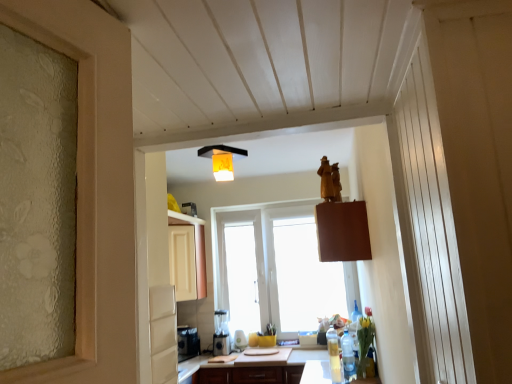
Describe the element at coordinates (221, 334) in the screenshot. I see `black plastic coffee machine at lower center` at that location.

Where is `black plastic coffee machine at lower center`? This screenshot has height=384, width=512. black plastic coffee machine at lower center is located at coordinates (221, 334).

Looking at this image, what is the approximate height of clear plastic bottle at lower right, acting as the 1th bottle starting from the front?

The height of clear plastic bottle at lower right, acting as the 1th bottle starting from the front, is 13.37 inches.

This screenshot has height=384, width=512. What are the coordinates of `clear plastic bottle at lower right, which ranks as the second bottle in back-to-front order` in the screenshot? It's located at (348, 355).

This screenshot has height=384, width=512. Describe the element at coordinates (334, 354) in the screenshot. I see `translucent plastic bottle at lower right, arranged as the second bottle when viewed from the front` at that location.

You are a GUI agent. You are given a task and a screenshot of the screen. Output one action in this format:
    pyautogui.click(x=<x>, y=<y>)
    Task: Click on the wooden statue at upper center
    
    Given the screenshot: What is the action you would take?
    pyautogui.click(x=268, y=254)

Where is `white matte cabinet at upper left`? white matte cabinet at upper left is located at coordinates (187, 256).

This screenshot has width=512, height=384. Find the location of `black plastic coffee machine at lower center`. black plastic coffee machine at lower center is located at coordinates (221, 334).

From the image's perspective, relative to clear plastic bottle at lower right, acting as the 1th bottle starting from the front, is orange fabric lampshade at upper center above or below?

Based on their image positions, orange fabric lampshade at upper center is located above clear plastic bottle at lower right, acting as the 1th bottle starting from the front.

Is orange fabric lampshade at upper center shorter than clear plastic bottle at lower right, acting as the 1th bottle starting from the front?

Correct, orange fabric lampshade at upper center is not as tall as clear plastic bottle at lower right, acting as the 1th bottle starting from the front.

Do you think orange fabric lampshade at upper center is within clear plastic bottle at lower right, acting as the 1th bottle starting from the front, or outside of it?

orange fabric lampshade at upper center is spatially situated outside clear plastic bottle at lower right, acting as the 1th bottle starting from the front.

Is orange fabric lampshade at upper center in front of or behind translucent plastic bottle at lower right, which is counted as the first bottle, starting from the back, in the image?

orange fabric lampshade at upper center is in front of translucent plastic bottle at lower right, which is counted as the first bottle, starting from the back.

In the scene shown: Considering the relative sizes of orange fabric lampshade at upper center and translucent plastic bottle at lower right, which is counted as the first bottle, starting from the back, in the image provided, is orange fabric lampshade at upper center shorter than translucent plastic bottle at lower right, which is counted as the first bottle, starting from the back,?

Yes, orange fabric lampshade at upper center is shorter than translucent plastic bottle at lower right, which is counted as the first bottle, starting from the back.

Does orange fabric lampshade at upper center have a larger size compared to translucent plastic bottle at lower right, arranged as the second bottle when viewed from the front?

Yes.

Between wooden statue at upper center and black plastic coffee machine at lower center, which one has larger size?

wooden statue at upper center.

Can you confirm if wooden statue at upper center is taller than black plastic coffee machine at lower center?

Yes, wooden statue at upper center is taller than black plastic coffee machine at lower center.

From the image's perspective, which one is positioned lower, wooden statue at upper center or black plastic coffee machine at lower center?

black plastic coffee machine at lower center.

Is black plastic coffee machine at lower center inside wooden statue at upper center?

No, black plastic coffee machine at lower center is not surrounded by wooden statue at upper center.

From the image's perspective, is matte brown countertop at center over translucent plastic bottle at lower right, arranged as the second bottle when viewed from the front?

No, from the image's perspective, matte brown countertop at center is not above translucent plastic bottle at lower right, arranged as the second bottle when viewed from the front.

Considering the relative sizes of matte brown countertop at center and translucent plastic bottle at lower right, which is counted as the first bottle, starting from the back, in the image provided, is matte brown countertop at center shorter than translucent plastic bottle at lower right, which is counted as the first bottle, starting from the back,?

No, matte brown countertop at center is not shorter than translucent plastic bottle at lower right, which is counted as the first bottle, starting from the back.

Can you confirm if matte brown countertop at center is wider than translucent plastic bottle at lower right, arranged as the second bottle when viewed from the front?

Yes.

In the scene shown: In the image, is clear plastic bottle at lower right, acting as the 1th bottle starting from the front, positioned in front of or behind wooden statue at upper center?

clear plastic bottle at lower right, acting as the 1th bottle starting from the front, is positioned farther from the viewer than wooden statue at upper center.

Is clear plastic bottle at lower right, which ranks as the second bottle in back-to-front order, smaller than wooden statue at upper center?

Correct, clear plastic bottle at lower right, which ranks as the second bottle in back-to-front order, occupies less space than wooden statue at upper center.

Based on the photo, from the image's perspective, which object appears higher, clear plastic bottle at lower right, which ranks as the second bottle in back-to-front order, or wooden statue at upper center?

wooden statue at upper center is shown above in the image.

Is clear plastic bottle at lower right, acting as the 1th bottle starting from the front, not close to wooden statue at upper center?

That's right, there is a large distance between clear plastic bottle at lower right, acting as the 1th bottle starting from the front, and wooden statue at upper center.

Considering the points (344, 360) and (217, 382), which point is behind, point (344, 360) or point (217, 382)?

The point (217, 382) is farther from the camera.

You are a GUI agent. You are given a task and a screenshot of the screen. Output one action in this format:
    pyautogui.click(x=<x>, y=<y>)
    Task: Click on the countertop that is on the left side of clear plastic bottle at lower right, which ranks as the second bottle in back-to-front order
    The width and height of the screenshot is (512, 384).
    Given the screenshot: What is the action you would take?
    pyautogui.click(x=257, y=371)

Can you confirm if clear plastic bottle at lower right, acting as the 1th bottle starting from the front, is positioned to the left of matte brown countertop at center?

No, clear plastic bottle at lower right, acting as the 1th bottle starting from the front, is not to the left of matte brown countertop at center.

Does clear plastic bottle at lower right, acting as the 1th bottle starting from the front, have a lesser width compared to matte brown countertop at center?

Yes, clear plastic bottle at lower right, acting as the 1th bottle starting from the front, is thinner than matte brown countertop at center.

Looking at this image, which of these two, clear plastic bottle at lower right, which ranks as the second bottle in back-to-front order, or black plastic coffee machine at lower center, stands taller?

Standing taller between the two is black plastic coffee machine at lower center.

Consider the image. Is clear plastic bottle at lower right, acting as the 1th bottle starting from the front, oriented away from black plastic coffee machine at lower center?

clear plastic bottle at lower right, acting as the 1th bottle starting from the front, does not have its back to black plastic coffee machine at lower center.

Are clear plastic bottle at lower right, which ranks as the second bottle in back-to-front order, and black plastic coffee machine at lower center beside each other?

No.

From the image's perspective, between clear plastic bottle at lower right, acting as the 1th bottle starting from the front, and black plastic coffee machine at lower center, which one is located above?

From the image's view, clear plastic bottle at lower right, acting as the 1th bottle starting from the front, is above.

You are a GUI agent. You are given a task and a screenshot of the screen. Output one action in this format:
    pyautogui.click(x=<x>, y=<y>)
    Task: Click on the light fixture that is above the clear plastic bottle at lower right, which ranks as the second bottle in back-to-front order (from the image's perspective)
    Image resolution: width=512 pixels, height=384 pixels.
    Given the screenshot: What is the action you would take?
    pyautogui.click(x=222, y=160)

Starting from the orange fabric lampshade at upper center, which bottle is the 2nd one behind? Please provide its 2D coordinates.

[(334, 354)]

Considering their positions, is white matte cabinet at upper left positioned further to clear plastic bottle at lower right, which ranks as the second bottle in back-to-front order, than translucent plastic bottle at lower right, which is counted as the first bottle, starting from the back?

Among the two, white matte cabinet at upper left is located further to clear plastic bottle at lower right, which ranks as the second bottle in back-to-front order.

When comparing their distances from translucent plastic bottle at lower right, arranged as the second bottle when viewed from the front, does clear plastic bottle at lower right, which ranks as the second bottle in back-to-front order, or black plastic coffee machine at lower center seem closer?

Among the two, clear plastic bottle at lower right, which ranks as the second bottle in back-to-front order, is located nearer to translucent plastic bottle at lower right, arranged as the second bottle when viewed from the front.

When comparing their distances from clear plastic bottle at lower right, acting as the 1th bottle starting from the front, does matte brown countertop at center or translucent plastic bottle at lower right, arranged as the second bottle when viewed from the front, seem further?

The object further to clear plastic bottle at lower right, acting as the 1th bottle starting from the front, is matte brown countertop at center.

Which object lies nearer to the anchor point black plastic coffee machine at lower center, white matte cabinet at upper left or orange fabric lampshade at upper center?

white matte cabinet at upper left lies closer to black plastic coffee machine at lower center than the other object.

Considering their positions, is black plastic coffee machine at lower center positioned further to wooden statue at upper center than white matte cabinet at upper left?

black plastic coffee machine at lower center lies further to wooden statue at upper center than the other object.

Based on their spatial positions, is translucent plastic bottle at lower right, arranged as the second bottle when viewed from the front, or orange fabric lampshade at upper center further from wooden statue at upper center?

orange fabric lampshade at upper center is further to wooden statue at upper center.

Looking at this image, estimate the real-world distances between objects in this image. Which object is closer to white matte cabinet at upper left, black plastic coffee machine at lower center or wooden statue at upper center?

Among the two, wooden statue at upper center is located nearer to white matte cabinet at upper left.

Which object lies further to the anchor point matte brown countertop at center, translucent plastic bottle at lower right, which is counted as the first bottle, starting from the back, or wooden statue at upper center?

wooden statue at upper center is positioned further to the anchor matte brown countertop at center.

This screenshot has height=384, width=512. I want to click on cabinetry that lies between orange fabric lampshade at upper center and translucent plastic bottle at lower right, arranged as the second bottle when viewed from the front, from top to bottom, so click(x=187, y=256).

Where is `countertop between white matte cabinet at upper left and translucent plastic bottle at lower right, arranged as the second bottle when viewed from the front`? The image size is (512, 384). countertop between white matte cabinet at upper left and translucent plastic bottle at lower right, arranged as the second bottle when viewed from the front is located at coordinates (257, 371).

You are a GUI agent. You are given a task and a screenshot of the screen. Output one action in this format:
    pyautogui.click(x=<x>, y=<y>)
    Task: Click on the countertop between black plastic coffee machine at lower center and translucent plastic bottle at lower right, arranged as the second bottle when viewed from the front
    Image resolution: width=512 pixels, height=384 pixels.
    Given the screenshot: What is the action you would take?
    pyautogui.click(x=257, y=371)

You are a GUI agent. You are given a task and a screenshot of the screen. Output one action in this format:
    pyautogui.click(x=<x>, y=<y>)
    Task: Click on the cabinetry between orange fabric lampshade at upper center and matte brown countertop at center vertically
    The height and width of the screenshot is (384, 512).
    Given the screenshot: What is the action you would take?
    pyautogui.click(x=187, y=256)